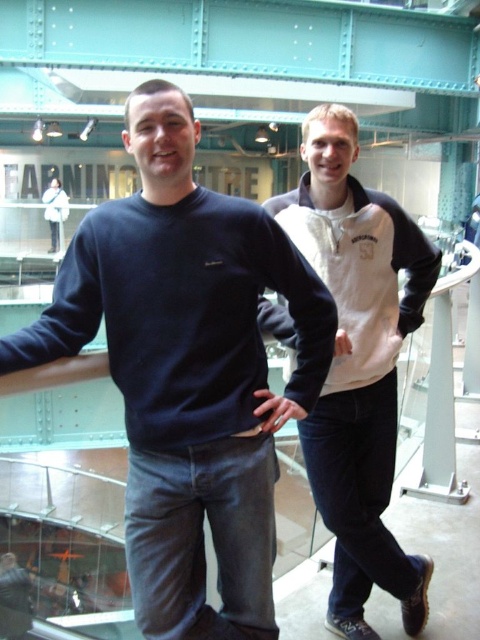
Question: Which of the following is the closest to the observer?

Choices:
 (A) white fleece at right
 (B) dark blue cotton sweatshirt at center
 (C) white fleece sweatshirt at right

Answer: (B)

Question: Which of the following is the farthest from the observer?

Choices:
 (A) (304, 461)
 (B) (163, 180)

Answer: (A)

Question: Is dark blue sweater at center thinner than dark blue cotton sweatshirt at center?

Choices:
 (A) yes
 (B) no

Answer: (A)

Question: From the image, what is the correct spatial relationship of white fleece at right in relation to matte black sweater at center?

Choices:
 (A) above
 (B) below

Answer: (B)

Question: Is dark blue sweater at center behind white fleece sweatshirt at right?

Choices:
 (A) yes
 (B) no

Answer: (B)

Question: Which object appears farthest from the camera in this image?

Choices:
 (A) dark blue sweater at center
 (B) white fleece sweatshirt at right
 (C) white fleece at right

Answer: (C)